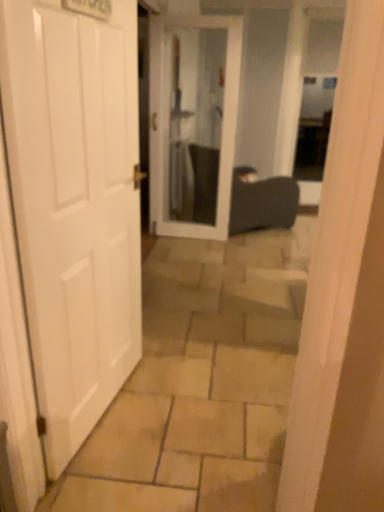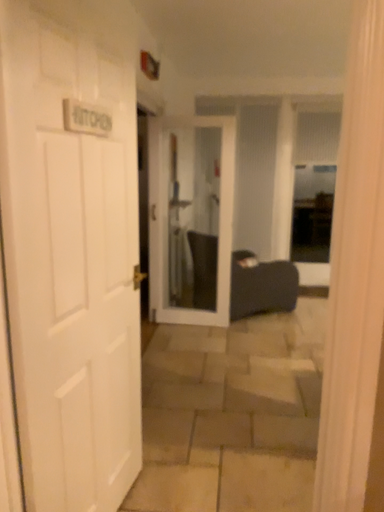
Question: Which way did the camera rotate in the video?

Choices:
 (A) rotated upward
 (B) rotated downward

Answer: (A)